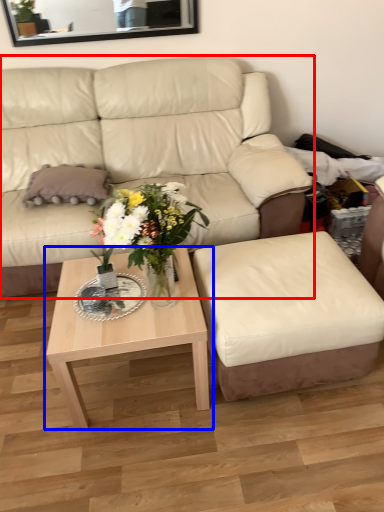
Question: Which object is further to the camera taking this photo, studio couch (highlighted by a red box) or coffee table (highlighted by a blue box)?

Choices:
 (A) studio couch
 (B) coffee table

Answer: (A)